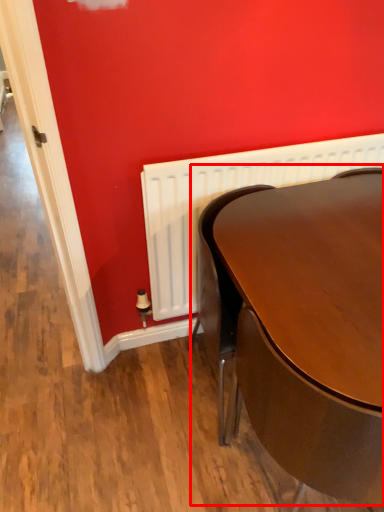
Question: Observing the image, what is the correct spatial positioning of table (annotated by the red box) in reference to radiator?

Choices:
 (A) right
 (B) left

Answer: (A)